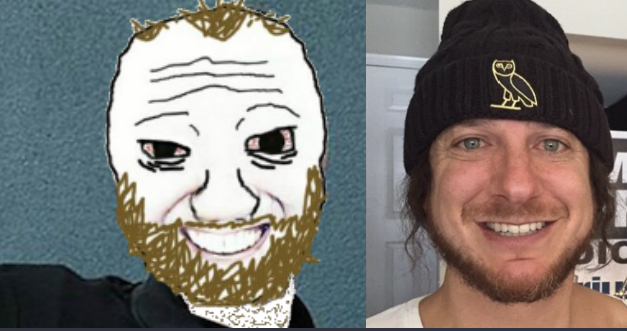
Where is `white door`? This screenshot has height=331, width=627. white door is located at coordinates (382, 96).